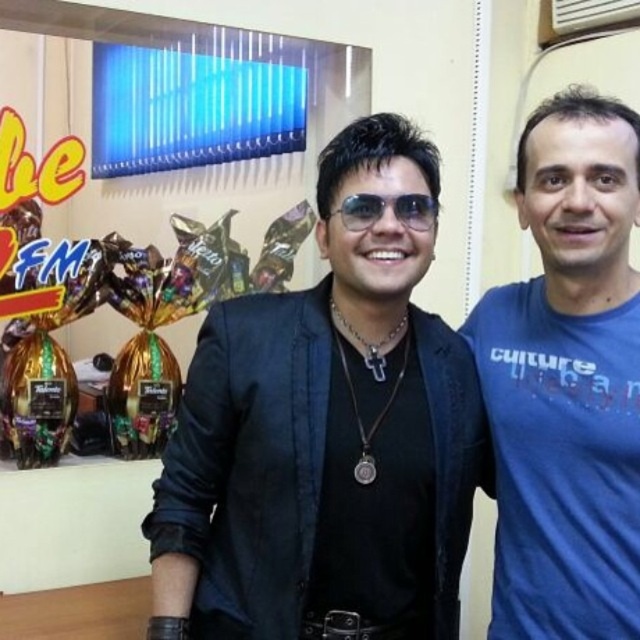
Describe the element at coordinates (324, 435) in the screenshot. The width and height of the screenshot is (640, 640). I see `black leather jacket at center` at that location.

Which is in front, point (260, 456) or point (570, 125)?

Point (260, 456) is more forward.

Which is in front, point (161, 515) or point (516, 380)?

Positioned in front is point (161, 515).

Locate an element on the screen. black leather jacket at center is located at coordinates (324, 435).

Who is taller, black leather jacket at center or sunglasses at center?

black leather jacket at center

Can you confirm if black leather jacket at center is shorter than sunglasses at center?

In fact, black leather jacket at center may be taller than sunglasses at center.

Is point (220, 419) positioned in front of point (419, 202)?

No.

You are a GUI agent. You are given a task and a screenshot of the screen. Output one action in this format:
    pyautogui.click(x=<x>, y=<y>)
    Task: Click on the black leather jacket at center
    This screenshot has width=640, height=640.
    Given the screenshot: What is the action you would take?
    pyautogui.click(x=324, y=435)

Does blue cotton t-shirt at right have a larger size compared to sunglasses at center?

Yes, blue cotton t-shirt at right is bigger than sunglasses at center.

Is blue cotton t-shirt at right thinner than sunglasses at center?

No, blue cotton t-shirt at right is not thinner than sunglasses at center.

Is point (561, 433) closer to viewer compared to point (420, 196)?

No.

The width and height of the screenshot is (640, 640). What are the coordinates of `blue cotton t-shirt at right` in the screenshot? It's located at (566, 381).